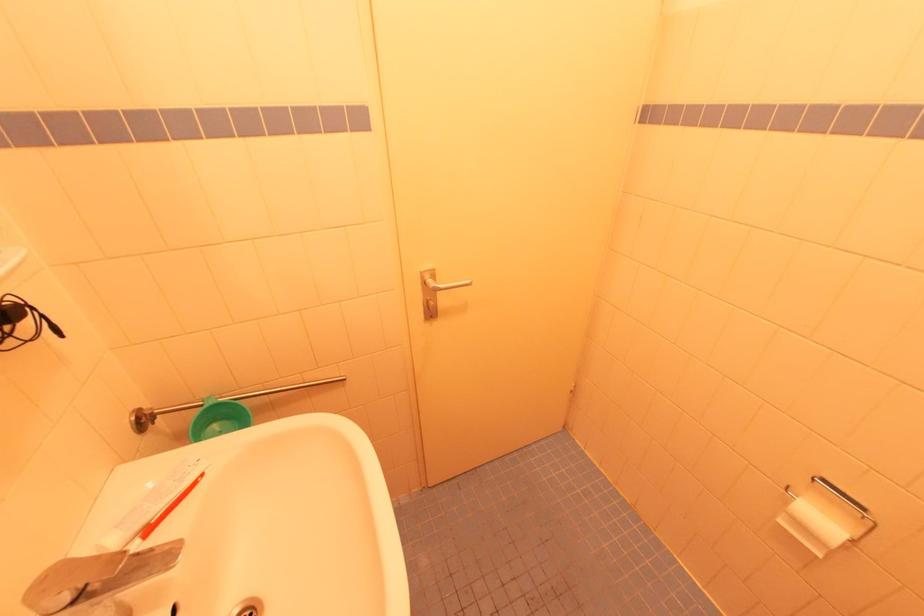
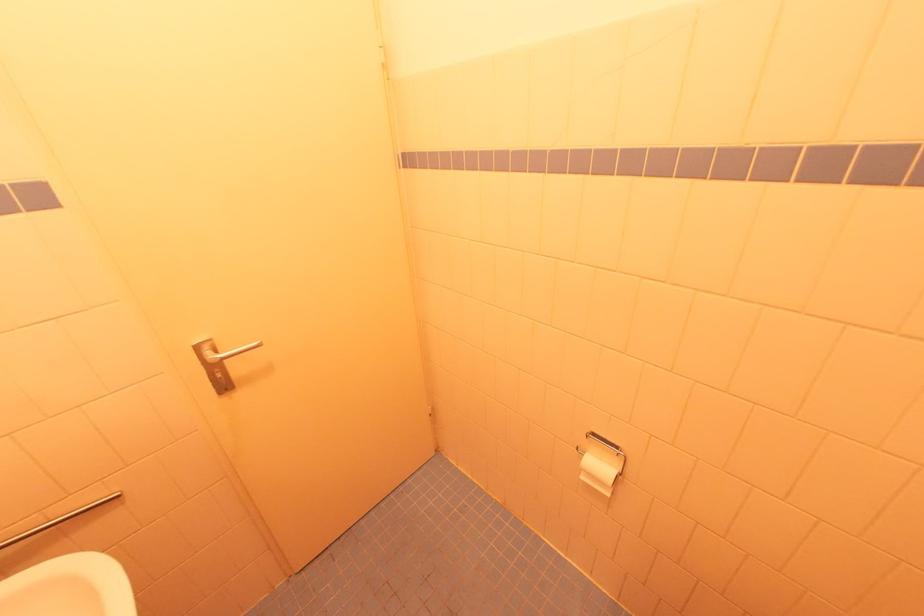
Where in the second image is the point corresponding to (423,272) from the first image?

(197, 345)